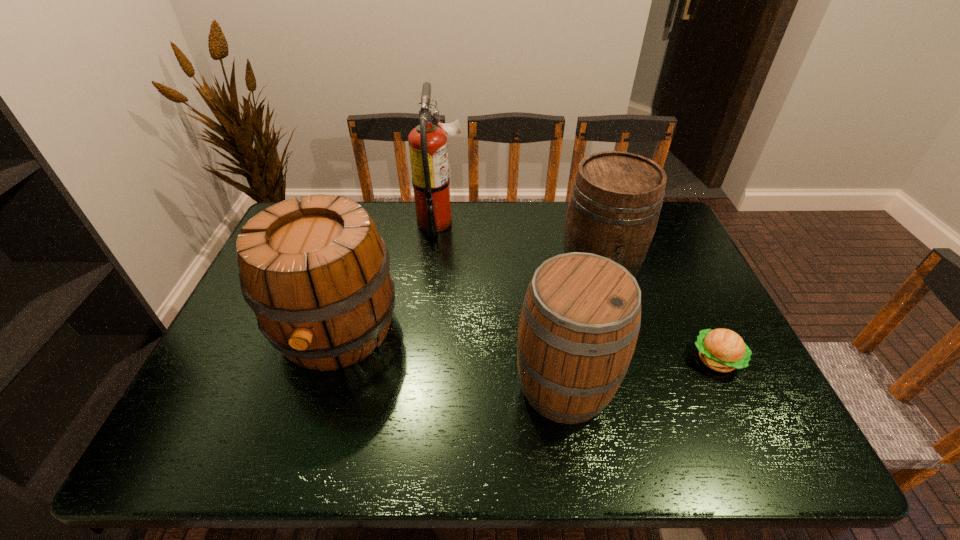
Identify the location of the tallest object. The height and width of the screenshot is (540, 960). (428, 150).

The height and width of the screenshot is (540, 960). In order to click on fire extinguisher in this screenshot , I will do `click(428, 150)`.

Locate an element on the screen. the leftmost cider is located at coordinates pyautogui.click(x=316, y=274).

Where is `the rightmost object`? This screenshot has width=960, height=540. the rightmost object is located at coordinates (723, 350).

Where is `the shortest object`? The height and width of the screenshot is (540, 960). the shortest object is located at coordinates click(x=723, y=350).

Where is `vacant space located from the nozzle of the tallest object`? vacant space located from the nozzle of the tallest object is located at coordinates (538, 222).

The width and height of the screenshot is (960, 540). I want to click on vacant space located 0.160m on the side of the leftmost cider where the spigot is located, so click(297, 456).

What are the coordinates of `free spot located on the left of the hamburger` in the screenshot? It's located at (654, 360).

You are a GUI agent. You are given a task and a screenshot of the screen. Output one action in this format:
    pyautogui.click(x=<x>, y=<y>)
    Task: Click on the fire extinguisher that is at the far edge
    This screenshot has height=540, width=960.
    Given the screenshot: What is the action you would take?
    pyautogui.click(x=428, y=150)

The height and width of the screenshot is (540, 960). Find the location of `cider that is at the far edge`. cider that is at the far edge is located at coordinates (614, 207).